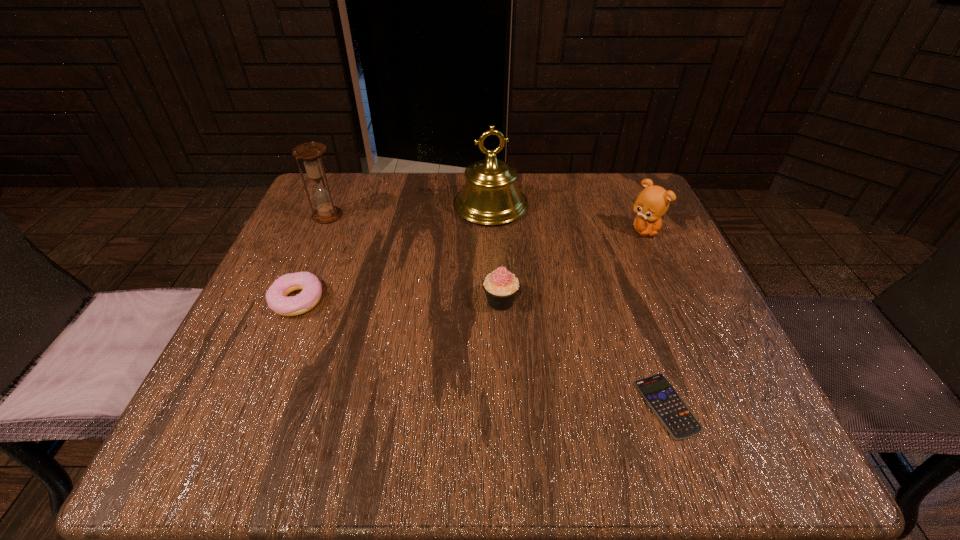
Find the location of a particular element. vacant space located on the face of the teddy bear is located at coordinates (688, 328).

At what (x,y) coordinates should I click in order to perform the action: click on free space located 0.110m on the left of the fourth tallest object. Please return your answer as a coordinate pair (x, y). The image size is (960, 540). Looking at the image, I should click on (422, 301).

The width and height of the screenshot is (960, 540). I want to click on free spot located on the back of the second shortest object, so click(x=316, y=258).

You are a GUI agent. You are given a task and a screenshot of the screen. Output one action in this format:
    pyautogui.click(x=<x>, y=<y>)
    Task: Click on the vacant space located 0.170m on the left of the fifth object from left to right
    This screenshot has height=540, width=960.
    Given the screenshot: What is the action you would take?
    [x=527, y=406]

Locate an element on the screen. This screenshot has width=960, height=540. bell that is at the far edge is located at coordinates (490, 196).

Where is `hourglass that is at the far edge`? The image size is (960, 540). hourglass that is at the far edge is located at coordinates [x=310, y=153].

This screenshot has height=540, width=960. Find the location of `teddy bear that is at the far edge`. teddy bear that is at the far edge is located at coordinates pos(652,203).

You are a GUI agent. You are given a task and a screenshot of the screen. Output one action in this format:
    pyautogui.click(x=<x>, y=<y>)
    Task: Click on the object at the near edge
    The image size is (960, 540).
    Given the screenshot: What is the action you would take?
    pyautogui.click(x=674, y=414)

Image resolution: width=960 pixels, height=540 pixels. In order to click on hourglass situated at the left edge in this screenshot , I will do `click(310, 153)`.

Locate an element on the screen. doughnut that is positioned at the left edge is located at coordinates (276, 296).